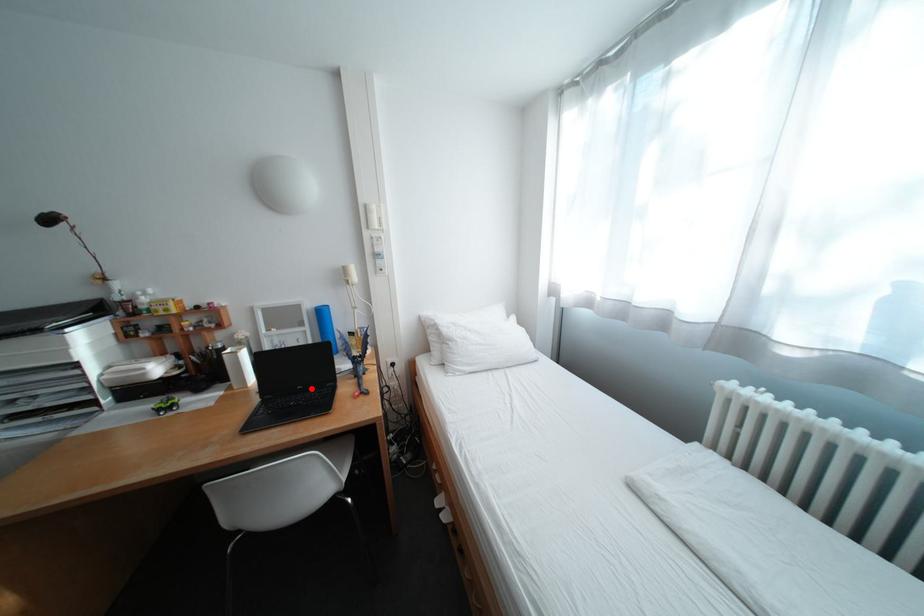
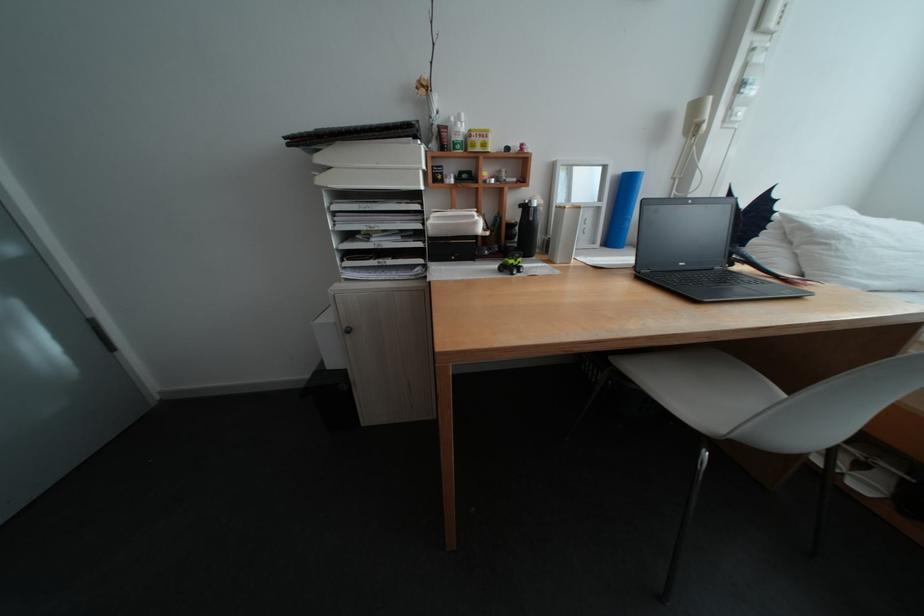
In the second image, find the point that corresponds to the highlighted location in the first image.

(694, 265)